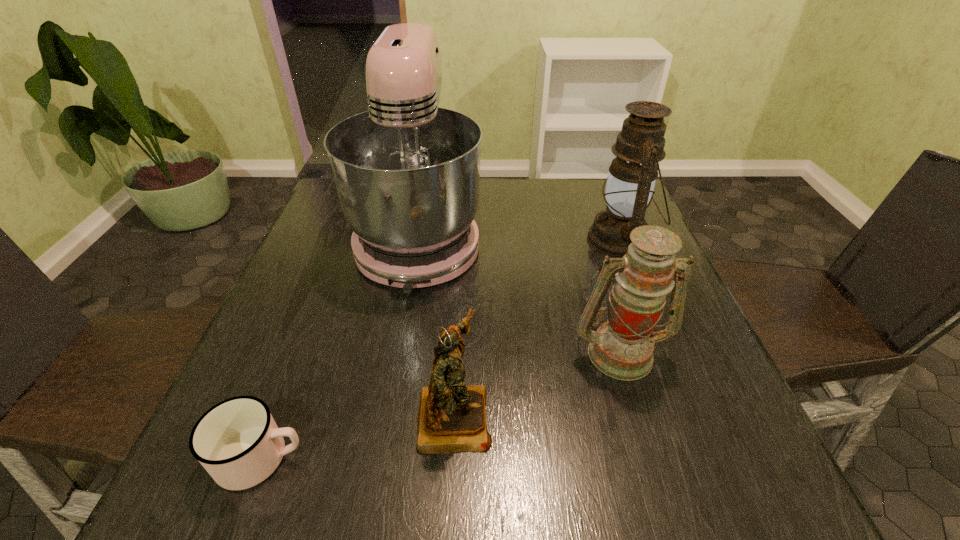
Where is `free space between the second shortest object and the mixer`? This screenshot has height=540, width=960. free space between the second shortest object and the mixer is located at coordinates (437, 327).

The width and height of the screenshot is (960, 540). What are the coordinates of `free spot between the second shortest object and the taller oil lamp` in the screenshot? It's located at (538, 327).

In order to click on free space between the third tallest object and the mixer in this screenshot , I will do `click(519, 295)`.

Choose which object is the third nearest neighbor to the third farthest object. Please provide its 2D coordinates. Your answer should be formatted as a tuple, i.e. [(x, y)], where the tuple contains the x and y coordinates of a point satisfying the conditions above.

[(630, 184)]

At what (x,y) coordinates should I click in order to perform the action: click on the fourth closest object to the farther oil lamp. Please return your answer as a coordinate pair (x, y). This screenshot has width=960, height=540. Looking at the image, I should click on (237, 441).

At what (x,y) coordinates should I click in order to perform the action: click on free space in the image that satisfies the following two spatial constraints: 1. on the front-facing side of the tallest object; 2. on the side of the mug with the handle. Please return your answer as a coordinate pair (x, y). Looking at the image, I should click on (381, 458).

Locate an element on the screen. This screenshot has height=540, width=960. vacant area that satisfies the following two spatial constraints: 1. on the front-facing side of the tallest object; 2. on the side of the shortest object with the handle is located at coordinates (381, 458).

At what (x,y) coordinates should I click in order to perform the action: click on vacant space that satisfies the following two spatial constraints: 1. on the front-facing side of the tallest object; 2. on the side of the shortest object with the handle. Please return your answer as a coordinate pair (x, y). Looking at the image, I should click on (381, 458).

Where is `free location that satisfies the following two spatial constraints: 1. on the front side of the fourth shortest object; 2. on the front-facing side of the figurine`? free location that satisfies the following two spatial constraints: 1. on the front side of the fourth shortest object; 2. on the front-facing side of the figurine is located at coordinates (692, 415).

At what (x,y) coordinates should I click in order to perform the action: click on vacant space that satisfies the following two spatial constraints: 1. on the front-facing side of the tallest object; 2. on the left side of the third farthest object. Please return your answer as a coordinate pair (x, y). This screenshot has width=960, height=540. Looking at the image, I should click on (399, 352).